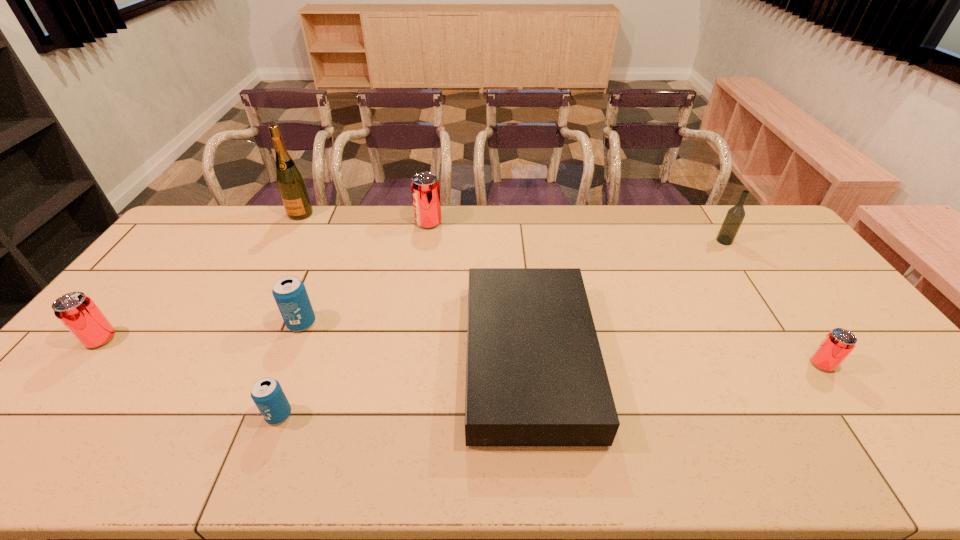
You are a GUI agent. You are given a task and a screenshot of the screen. Output one action in this format:
    pyautogui.click(x=<x>, y=<y>)
    Task: Click on the free space located on the right of the nearest red soda can
    This screenshot has width=960, height=540.
    Given the screenshot: What is the action you would take?
    pyautogui.click(x=879, y=364)

Where is `blank space located 0.280m on the right of the smaller blue soda can`? The width and height of the screenshot is (960, 540). blank space located 0.280m on the right of the smaller blue soda can is located at coordinates (410, 415).

Locate an element on the screen. This screenshot has width=960, height=540. blank area located 0.130m at the front of the sixth object from left to right for disc insertion is located at coordinates (419, 359).

This screenshot has width=960, height=540. I want to click on vacant space situated 0.250m at the front of the sixth object from left to right for disc insertion, so click(x=373, y=359).

Identify the location of vacant area located 0.320m at the front of the sixth object from left to right for disc insertion. (348, 359).

Where is `wine bottle that is positioned at the far edge`? The image size is (960, 540). wine bottle that is positioned at the far edge is located at coordinates (291, 185).

Where is `vodka located at the far edge`? The height and width of the screenshot is (540, 960). vodka located at the far edge is located at coordinates (735, 215).

Locate an element on the screen. The image size is (960, 540). soda can that is at the far edge is located at coordinates pos(425,188).

Where is `object that is at the near edge`? Image resolution: width=960 pixels, height=540 pixels. object that is at the near edge is located at coordinates (535, 376).

Identify the location of object present at the left edge. Image resolution: width=960 pixels, height=540 pixels. (76, 311).